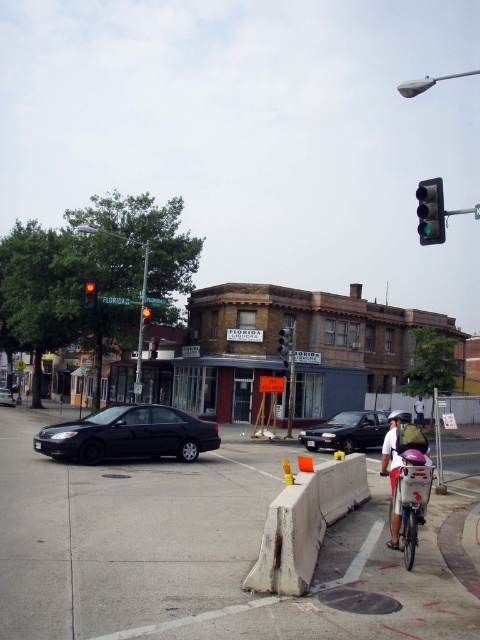
Who is higher up, red glass traffic light at upper left or light blue shirt at center?

red glass traffic light at upper left is higher up.

In the scene shown: Which of these two, red glass traffic light at upper left or light blue shirt at center, stands shorter?

With less height is light blue shirt at center.

The width and height of the screenshot is (480, 640). What do you see at coordinates (90, 294) in the screenshot?
I see `red glass traffic light at upper left` at bounding box center [90, 294].

The height and width of the screenshot is (640, 480). I want to click on red glass traffic light at upper left, so click(x=90, y=294).

Looking at this image, can you confirm if concrete at center is taller than red glass traffic light at upper left?

Incorrect, concrete at center's height is not larger of red glass traffic light at upper left's.

Which is behind, point (332, 470) or point (86, 308)?

The point (86, 308) is behind.

Locate an element on the screen. The height and width of the screenshot is (640, 480). concrete at center is located at coordinates pyautogui.click(x=304, y=524).

What do you see at coordinates (304, 524) in the screenshot? I see `concrete at center` at bounding box center [304, 524].

Is concrete at center to the left of orange plastic traffic cone at center from the viewer's perspective?

Indeed, concrete at center is positioned on the left side of orange plastic traffic cone at center.

Describe the element at coordinates (304, 524) in the screenshot. I see `concrete at center` at that location.

You are a GUI agent. You are given a task and a screenshot of the screen. Output one action in this format:
    pyautogui.click(x=<x>, y=<y>)
    Task: Click on the concrete at center
    The height and width of the screenshot is (640, 480).
    Given the screenshot: What is the action you would take?
    pyautogui.click(x=304, y=524)